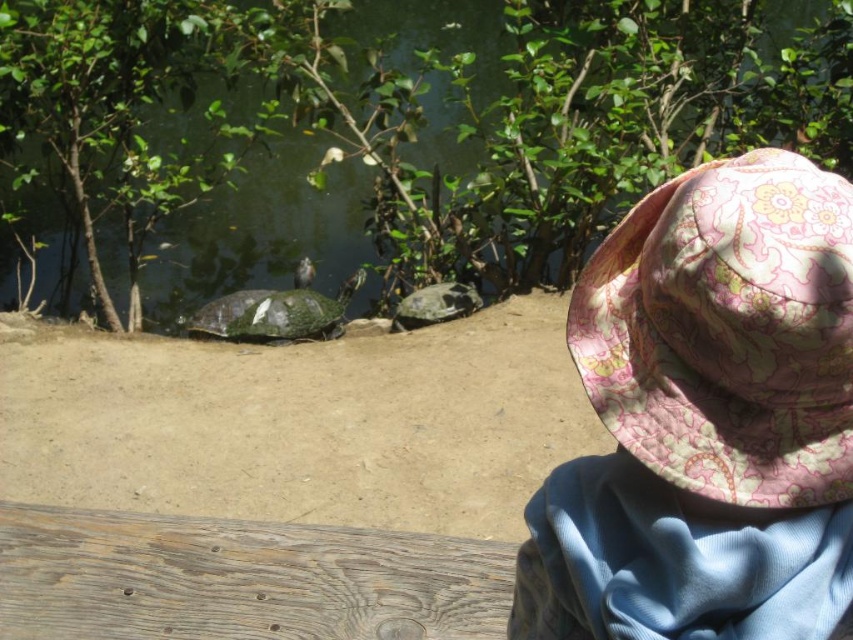
Question: Does green scaly tortoise at center appear on the right side of green textured tortoise at center?

Choices:
 (A) yes
 (B) no

Answer: (B)

Question: Is floral fabric sunhat at upper right wider than green textured tortoise at center?

Choices:
 (A) no
 (B) yes

Answer: (A)

Question: Among these objects, which one is nearest to the camera?

Choices:
 (A) floral fabric sunhat at upper right
 (B) green scaly tortoise at center
 (C) green textured tortoise at center

Answer: (A)

Question: Where is floral fabric sunhat at upper right located in relation to green scaly tortoise at center in the image?

Choices:
 (A) right
 (B) left

Answer: (A)

Question: Estimate the real-world distances between objects in this image. Which object is closer to the green textured tortoise at center?

Choices:
 (A) floral fabric sunhat at upper right
 (B) green scaly tortoise at center

Answer: (B)

Question: Considering the real-world distances, which object is farthest from the floral fabric sunhat at upper right?

Choices:
 (A) green textured tortoise at center
 (B) green scaly tortoise at center

Answer: (B)